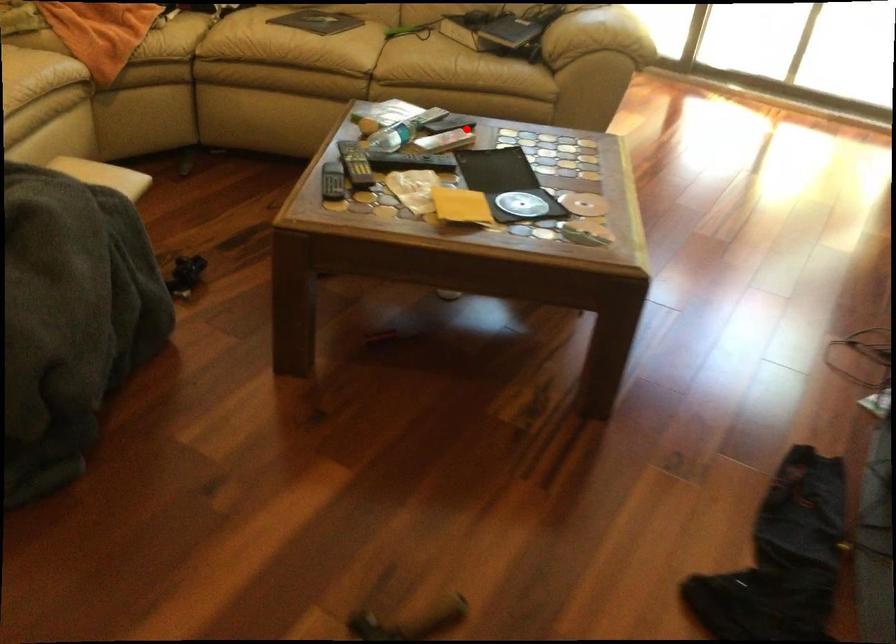
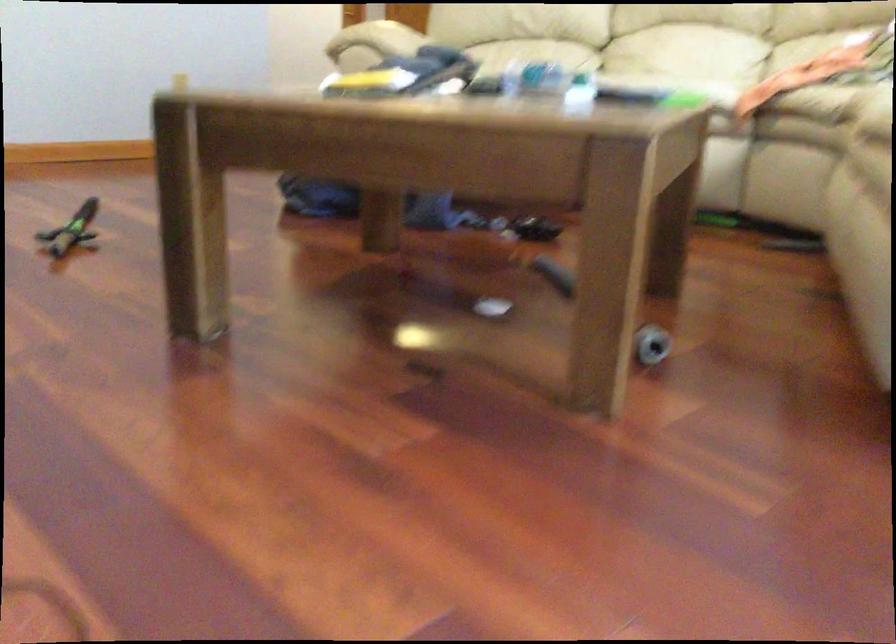
Question: I am providing you with two images of the same scene from different viewpoints. A red point is shown in image1. For the corresponding object point in image2, is it positioned nearer or farther from the camera?

Choices:
 (A) Nearer
 (B) Farther

Answer: (A)